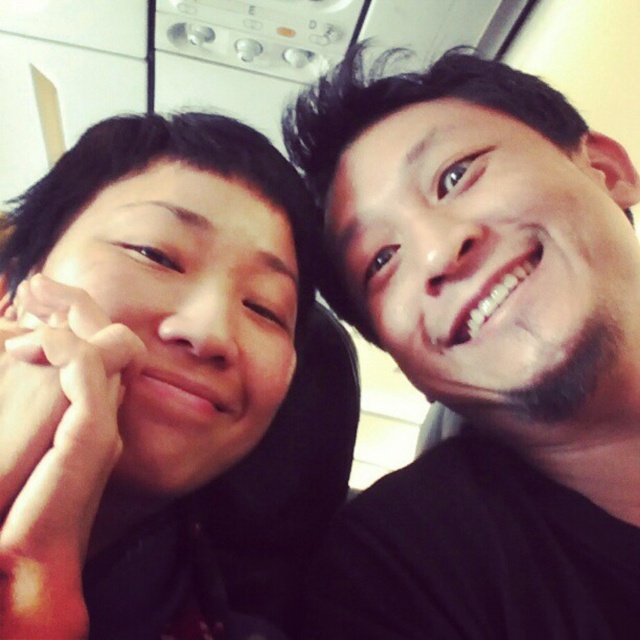
Is matte black hair at left bigger than smooth skin face at right?

Correct, matte black hair at left is larger in size than smooth skin face at right.

The width and height of the screenshot is (640, 640). I want to click on matte black hair at left, so click(198, 369).

Is smooth skin face at right to the left of matte skin face at left from the viewer's perspective?

Incorrect, smooth skin face at right is not on the left side of matte skin face at left.

Which is more to the left, smooth skin face at right or matte skin face at left?

Positioned to the left is matte skin face at left.

Is point (444, 275) positioned after point (176, 369)?

Yes, it is behind point (176, 369).

At what (x,y) coordinates should I click in order to perform the action: click on smooth skin face at right. Please return your answer as a coordinate pair (x, y). Looking at the image, I should click on (484, 252).

Which is below, black matte hair at upper right or smooth skin face at right?

black matte hair at upper right

Is point (428, 168) positioned in front of point (531, 228)?

No, it is not.

Where is `black matte hair at upper right`? This screenshot has height=640, width=640. black matte hair at upper right is located at coordinates (483, 352).